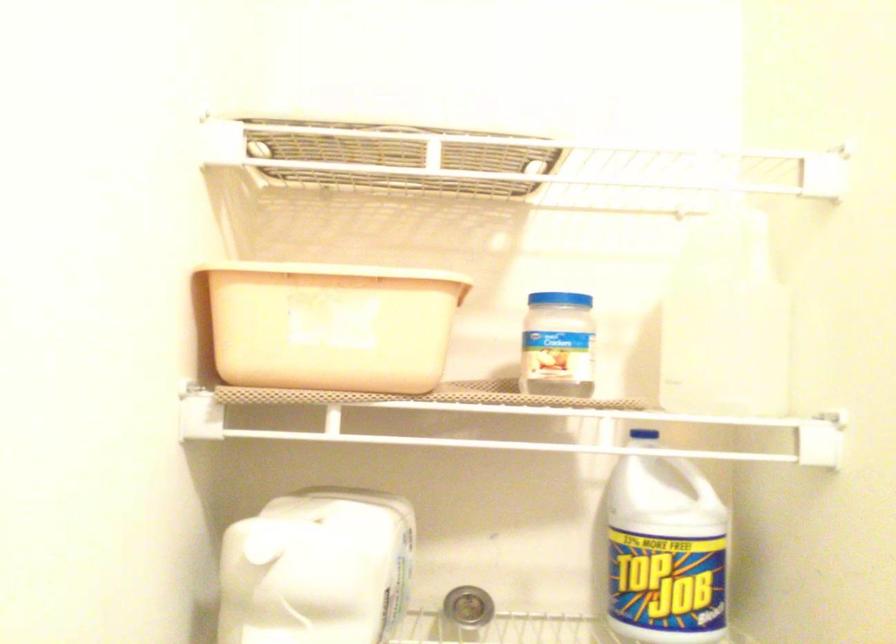
Locate an element on the screen. This screenshot has height=644, width=896. beige plastic tub is located at coordinates (330, 325).